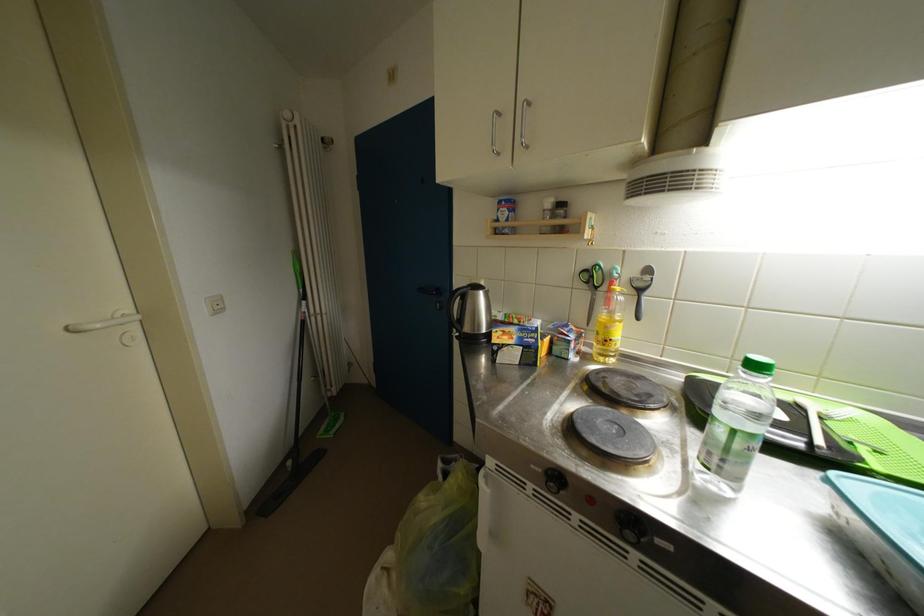
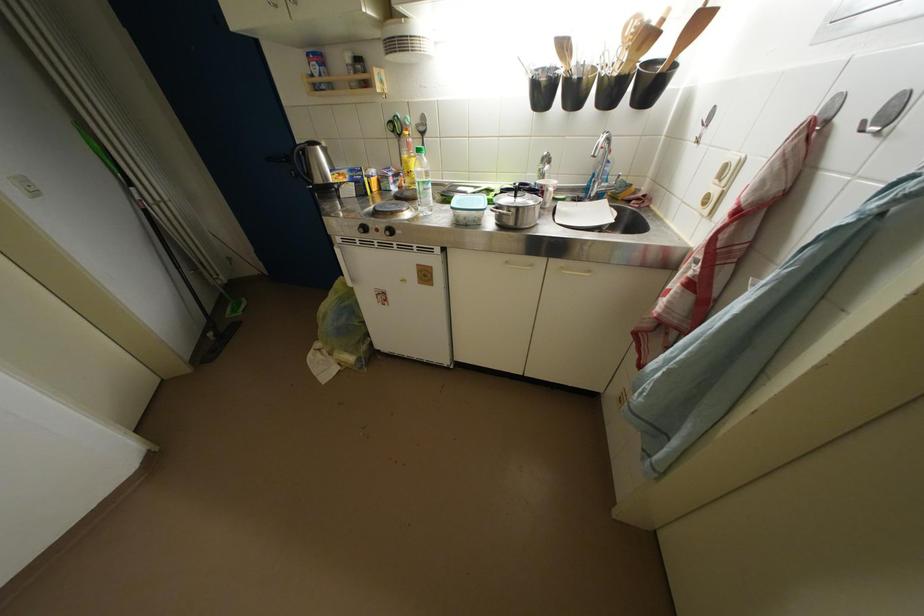
The point at (310, 314) is marked in the first image. Where is the corresponding point in the second image?

(144, 201)